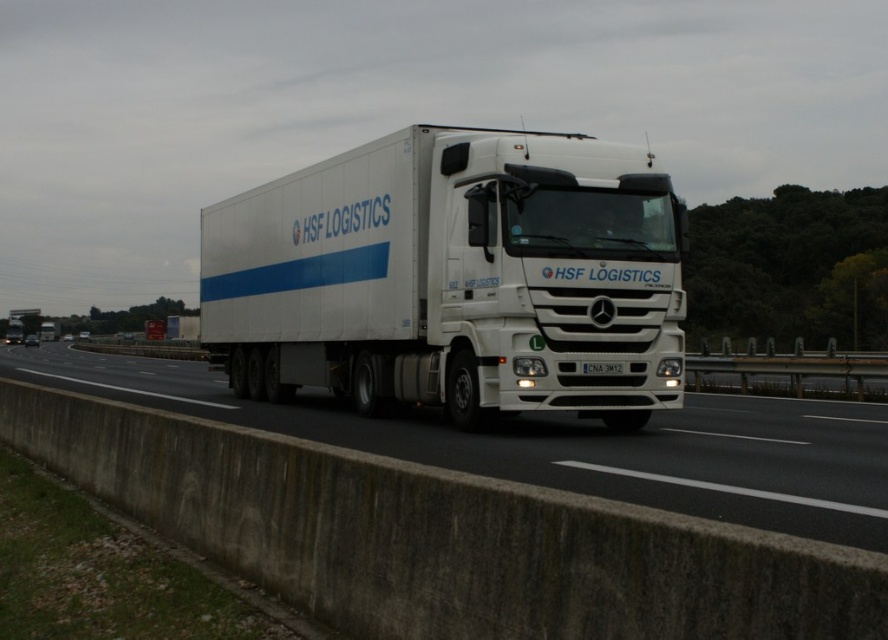
You are a driver who needs to check the license plate of the truck. From your current position, which side of the white concrete barrier at lower center should you look to find the white plastic license plate at center?

The white plastic license plate at center is to the right of the white concrete barrier at lower center, so you should look to the right side of the white concrete barrier at lower center to find it.

You are a driver approaching the white concrete barrier at lower center and the white plastic license plate at center. Which object is larger in size?

The white concrete barrier at lower center is bigger than the white plastic license plate at center, so the white concrete barrier at lower center is larger in size.

You are a driver approaching the white concrete barrier at lower center and the white plastic license plate at center. Which object is wider?

The white concrete barrier at lower center is wider than the white plastic license plate at center.